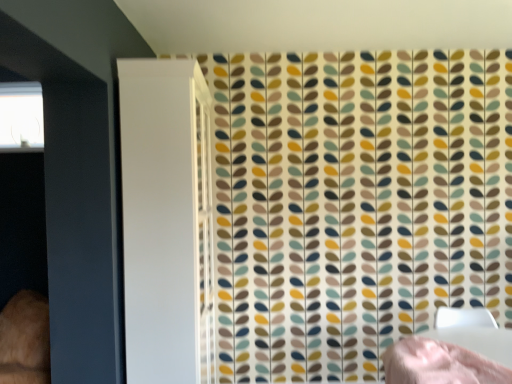
Question: From a real-world perspective, is white glossy screen door at left positioned above or below transparent glass window at upper left?

Choices:
 (A) below
 (B) above

Answer: (A)

Question: Considering their positions, is white glossy screen door at left located in front of or behind transparent glass window at upper left?

Choices:
 (A) behind
 (B) front

Answer: (B)

Question: Which object is positioned closest to the transparent glass window at upper left?

Choices:
 (A) pink fabric bed at lower right
 (B) white glossy screen door at left

Answer: (B)

Question: Which object is positioned farthest from the transparent glass window at upper left?

Choices:
 (A) white glossy screen door at left
 (B) pink fabric bed at lower right

Answer: (B)